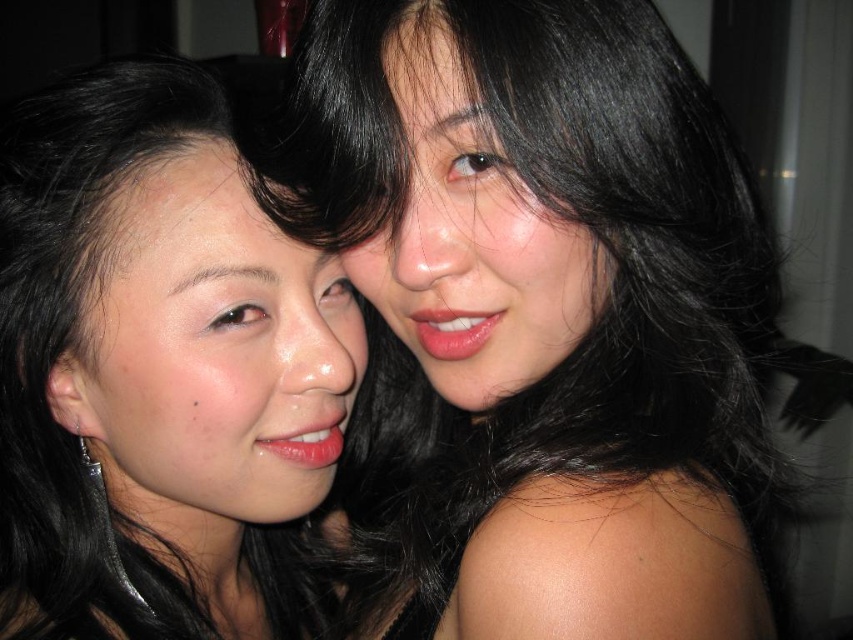
Is smooth skin face at upper right above matte pink lipstick at center?

Correct, smooth skin face at upper right is located above matte pink lipstick at center.

Is point (492, 246) closer to viewer compared to point (479, 339)?

Yes, it is in front of point (479, 339).

Is point (500, 173) behind point (471, 320)?

No.

At what (x,y) coordinates should I click in order to perform the action: click on smooth skin face at upper right. Please return your answer as a coordinate pair (x, y). The image size is (853, 640). Looking at the image, I should click on (473, 230).

Who is positioned more to the right, smooth skin face at left or matte pink lipstick at center?

matte pink lipstick at center

The width and height of the screenshot is (853, 640). In order to click on smooth skin face at left in this screenshot , I will do `click(210, 346)`.

Where is `smooth skin face at left`? This screenshot has height=640, width=853. smooth skin face at left is located at coordinates (210, 346).

Is matte black hair at left bigger than smooth skin face at upper right?

Yes.

Is matte black hair at left positioned in front of smooth skin face at upper right?

A: No.

You are a GUI agent. You are given a task and a screenshot of the screen. Output one action in this format:
    pyautogui.click(x=<x>, y=<y>)
    Task: Click on the matte black hair at left
    
    Given the screenshot: What is the action you would take?
    (160, 374)